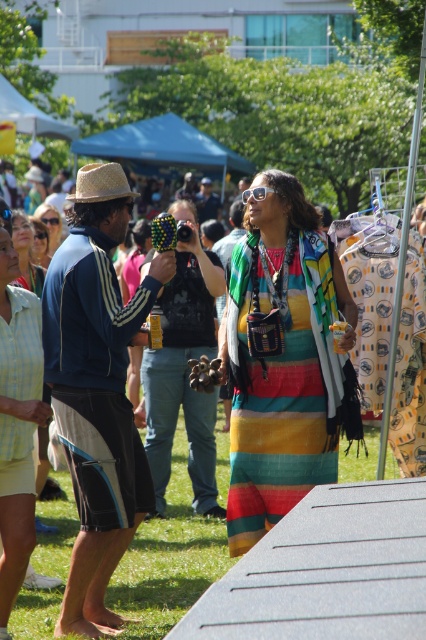
Question: Which of the following is the farthest from the observer?

Choices:
 (A) (112, 596)
 (B) (43, 284)
 (C) (279, 412)

Answer: (B)

Question: Which object is the closest to the matte black sunglasses at upper center?

Choices:
 (A) green grass at lower center
 (B) multicolored striped dress at center

Answer: (A)

Question: Does green grass at lower center have a larger size compared to matte black sunglasses at upper center?

Choices:
 (A) yes
 (B) no

Answer: (B)

Question: Which object is positioned farthest from the green grass at lower center?

Choices:
 (A) multicolored striped dress at center
 (B) matte black sunglasses at upper center

Answer: (B)

Question: Can you confirm if multicolored striped dress at center is positioned to the right of matte black sunglasses at upper center?

Choices:
 (A) no
 (B) yes

Answer: (B)

Question: Is multicolored striped dress at center closer to the viewer compared to green grass at lower center?

Choices:
 (A) yes
 (B) no

Answer: (A)